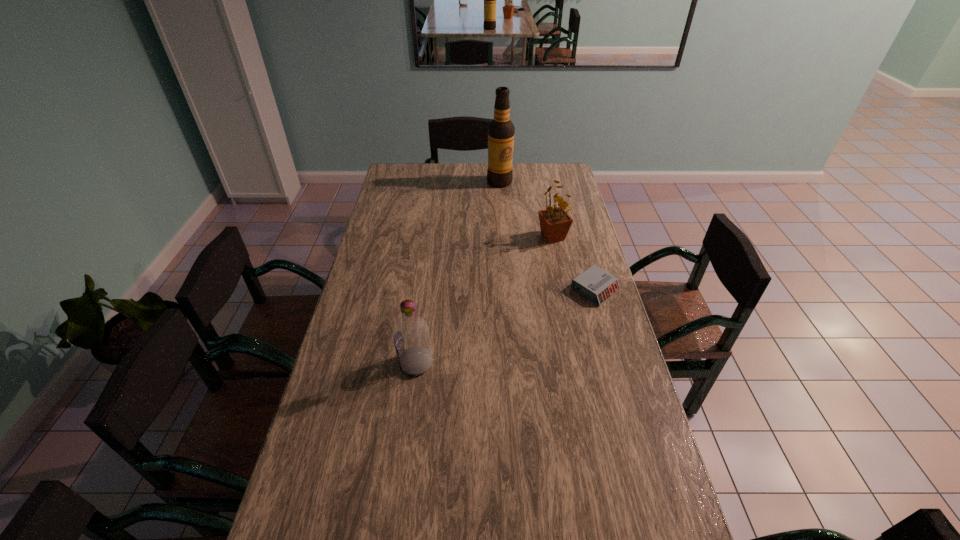
The image size is (960, 540). In the image, there is a desktop. What are the coordinates of `free space at the right edge` in the screenshot? It's located at (578, 242).

Where is `vacant space at the near left corner of the desktop`? This screenshot has height=540, width=960. vacant space at the near left corner of the desktop is located at coordinates (354, 515).

At what (x,y) coordinates should I click in order to perform the action: click on vacant area that lies between the second farthest object and the alarm clock. Please return your answer as a coordinate pair (x, y). The image size is (960, 540). Looking at the image, I should click on (574, 264).

You are a GUI agent. You are given a task and a screenshot of the screen. Output one action in this format:
    pyautogui.click(x=<x>, y=<y>)
    Task: Click on the free space between the tallest object and the third nearest object
    This screenshot has width=960, height=540.
    Given the screenshot: What is the action you would take?
    pyautogui.click(x=526, y=210)

I want to click on unoccupied area between the farthest object and the third nearest object, so click(526, 210).

The height and width of the screenshot is (540, 960). Identify the location of free space between the third nearest object and the leftmost object. (485, 300).

Find the location of a particular element. Image resolution: width=960 pixels, height=540 pixels. free spot between the nearest object and the sunflower is located at coordinates (485, 300).

The width and height of the screenshot is (960, 540). Find the location of `empty location between the third nearest object and the second nearest object`. empty location between the third nearest object and the second nearest object is located at coordinates click(574, 264).

Locate an element on the screen. unoccupied position between the leftmost object and the third nearest object is located at coordinates (485, 300).

The width and height of the screenshot is (960, 540). I want to click on vacant space in between the leftmost object and the shortest object, so click(506, 326).